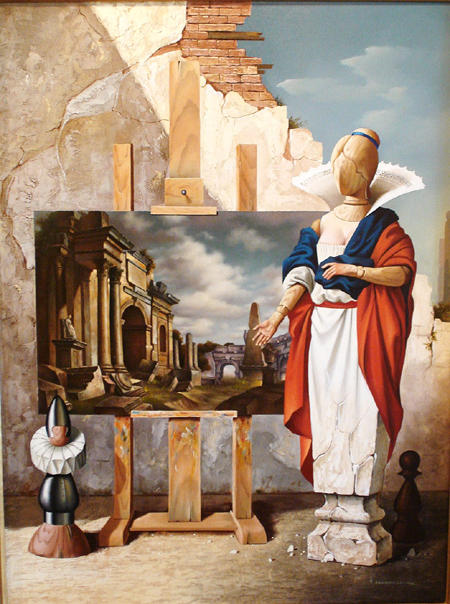
Locate an element on the screen. brick wall is located at coordinates (219, 65).